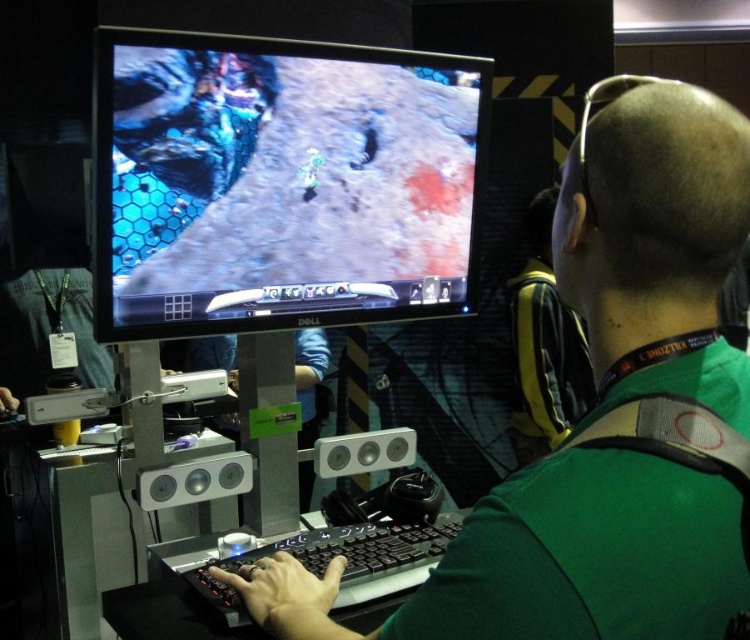
Question: Observing the image, what is the correct spatial positioning of green matte shirt at center in reference to black glossy monitor at upper center?

Choices:
 (A) left
 (B) right

Answer: (B)

Question: Which point is farther to the camera?

Choices:
 (A) (267, 65)
 (B) (711, 225)

Answer: (A)

Question: Which object is the farthest from the black glossy monitor at upper center?

Choices:
 (A) green matte shirt at center
 (B) yellow fabric backpack at upper right

Answer: (B)

Question: Can you confirm if green matte shirt at center is positioned below black glossy monitor at upper center?

Choices:
 (A) yes
 (B) no

Answer: (A)

Question: Does black glossy monitor at upper center have a greater width compared to yellow fabric backpack at upper right?

Choices:
 (A) yes
 (B) no

Answer: (A)

Question: Estimate the real-world distances between objects in this image. Which object is farther from the green matte shirt at center?

Choices:
 (A) black glossy monitor at upper center
 (B) yellow fabric backpack at upper right

Answer: (B)